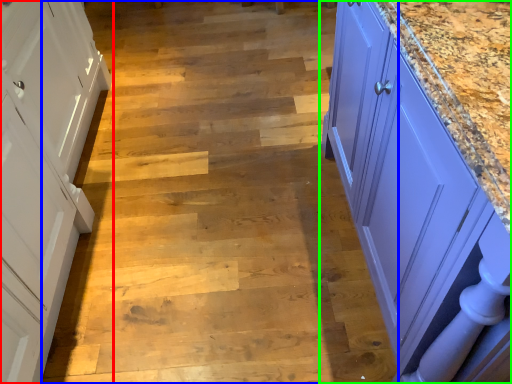
Question: Which object is positioned closest to cabinetry (highlighted by a red box)? Select from stair (highlighted by a blue box) and countertop (highlighted by a green box).

Choices:
 (A) stair
 (B) countertop

Answer: (A)